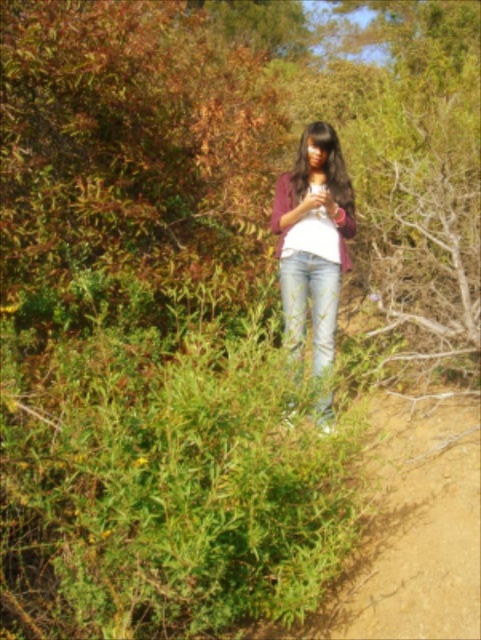
Who is more forward, (316, 145) or (320, 278)?

Point (316, 145) is in front.

Between point (309, 161) and point (290, 256), which one is positioned behind?

The point (309, 161) is more distant.

You are a GUI agent. You are given a task and a screenshot of the screen. Output one action in this format:
    pyautogui.click(x=<x>, y=<y>)
    Task: Click on the matte purple sweater at center
    The width and height of the screenshot is (481, 640).
    Given the screenshot: What is the action you would take?
    pyautogui.click(x=314, y=240)